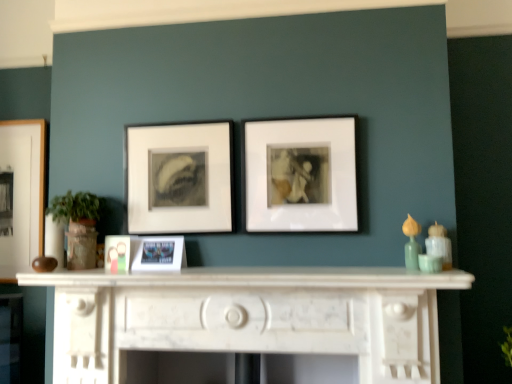
The height and width of the screenshot is (384, 512). Find the location of `vacant space situated on the left part of teal ceramic vase at right`. vacant space situated on the left part of teal ceramic vase at right is located at coordinates (377, 268).